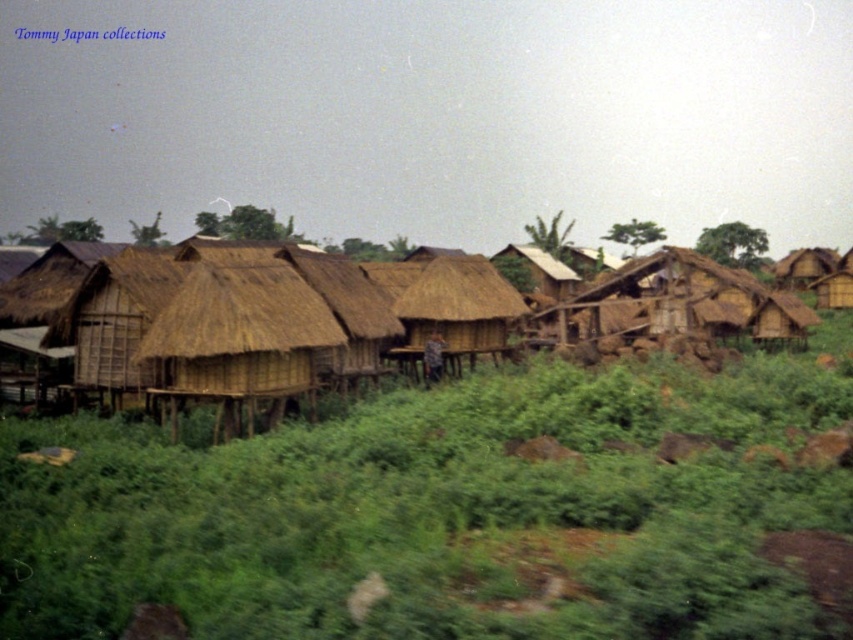
Question: Can you confirm if green grass at center is thinner than brown thatch hut at center?

Choices:
 (A) no
 (B) yes

Answer: (A)

Question: Does brown thatch hut at center appear under brown thatch hut at right?

Choices:
 (A) no
 (B) yes

Answer: (B)

Question: Which of the following is the closest to the observer?

Choices:
 (A) brown thatch hut at center
 (B) thatched straw hut at center
 (C) brown thatch hut at right

Answer: (A)

Question: Which point appears farthest from the camera in this image?

Choices:
 (A) (764, 314)
 (B) (408, 346)
 (C) (598, 376)
 (D) (219, 356)

Answer: (A)

Question: Which of the following is the farthest from the observer?

Choices:
 (A) (252, 310)
 (B) (209, 323)
 (C) (511, 300)

Answer: (C)

Question: Does brown thatch-roofed huts at center come behind brown thatch hut at center?

Choices:
 (A) no
 (B) yes

Answer: (B)